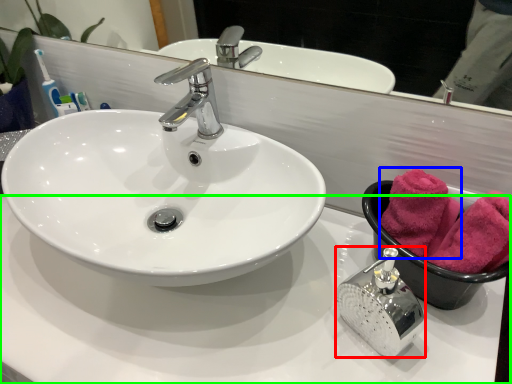
Question: Which object is positioned closest to soap dispenser (highlighted by a red box)? Select from bath towel (highlighted by a blue box) and counter top (highlighted by a green box).

Choices:
 (A) bath towel
 (B) counter top

Answer: (A)